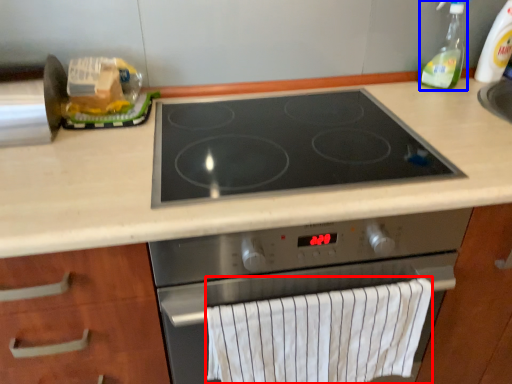
Question: Which of the following is the farthest to the observer, bath towel (highlighted by a red box) or soap dispenser (highlighted by a blue box)?

Choices:
 (A) bath towel
 (B) soap dispenser

Answer: (B)